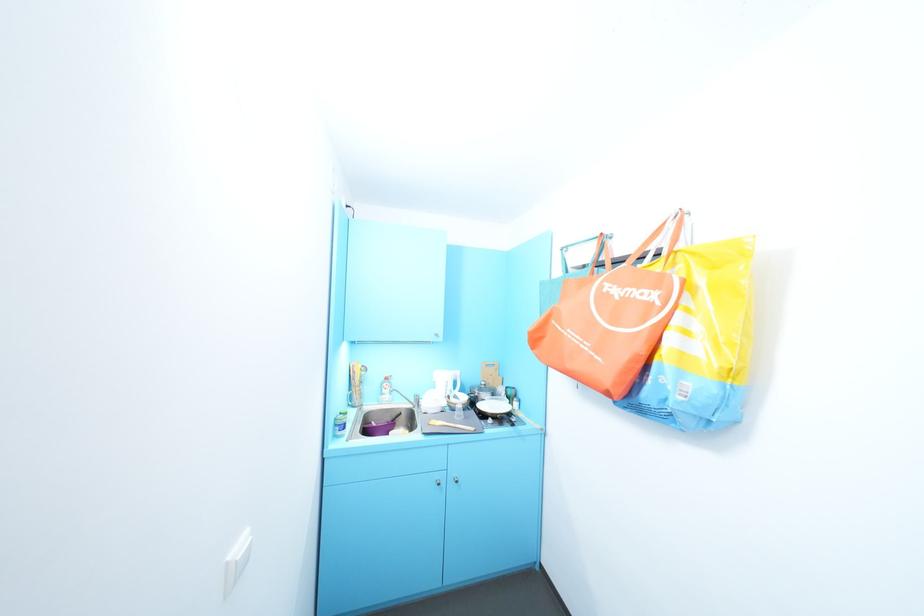
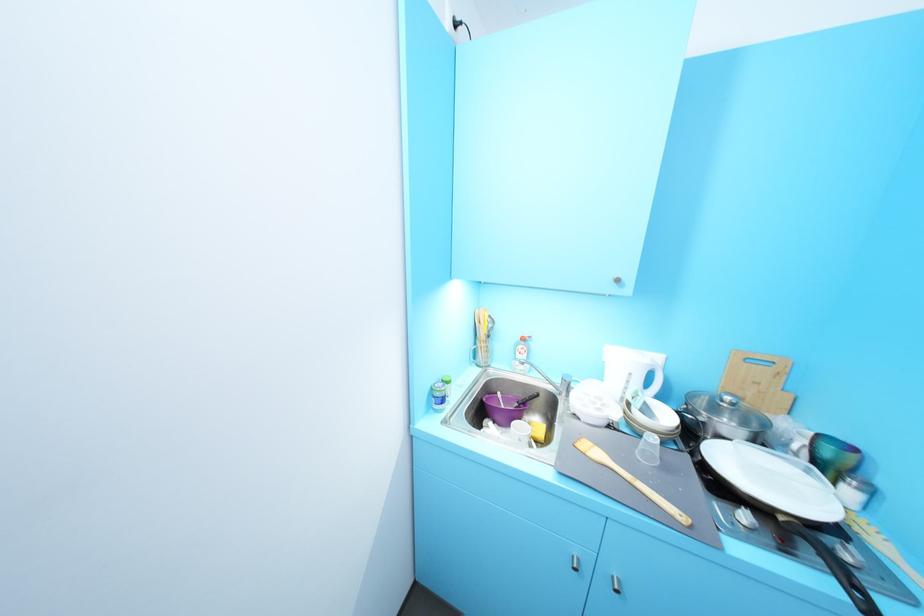
In the second image, find the point that corresponds to (x=490, y=384) in the first image.

(735, 399)